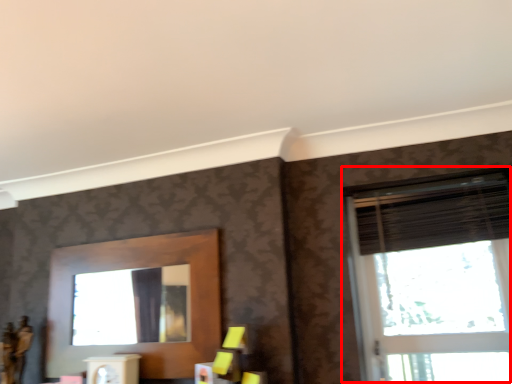
Question: Where is window (annotated by the red box) located in relation to blind in the image?

Choices:
 (A) left
 (B) right

Answer: (B)